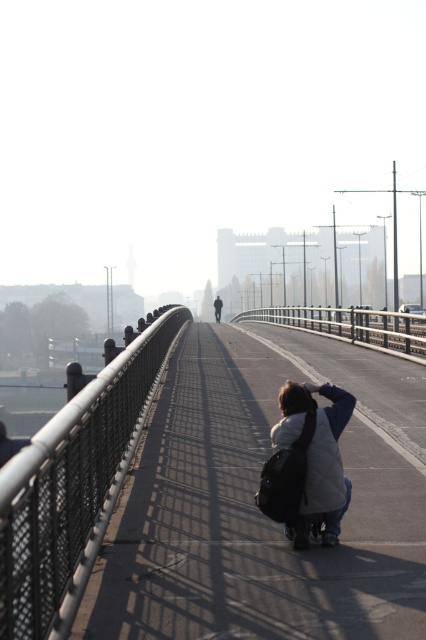
Who is taller, metallic bridge at center or black mesh fence at center?

metallic bridge at center is taller.

Describe the element at coordinates (215, 499) in the screenshot. I see `metallic bridge at center` at that location.

Which is in front, point (322, 592) or point (66, 593)?

Point (66, 593) is in front.

Where is `metallic bridge at center`? This screenshot has height=640, width=426. metallic bridge at center is located at coordinates (215, 499).

Can you confirm if metallic bridge at center is positioned below white matte jacket at lower center?

Incorrect, metallic bridge at center is not positioned below white matte jacket at lower center.

Measure the distance between metallic bridge at center and camera.

The distance of metallic bridge at center from camera is 9.11 feet.

This screenshot has width=426, height=640. In order to click on metallic bridge at center in this screenshot , I will do `click(215, 499)`.

Between black mesh fence at center and white matte jacket at lower center, which one appears on the left side from the viewer's perspective?

black mesh fence at center

Does black mesh fence at center lie in front of white matte jacket at lower center?

That is True.

Between point (146, 358) and point (308, 401), which one is positioned in front?

Positioned in front is point (308, 401).

You are a GUI agent. You are given a task and a screenshot of the screen. Output one action in this format:
    pyautogui.click(x=<x>, y=<y>)
    Task: Click on the black mesh fence at center
    This screenshot has width=426, height=640.
    Given the screenshot: What is the action you would take?
    pyautogui.click(x=74, y=484)